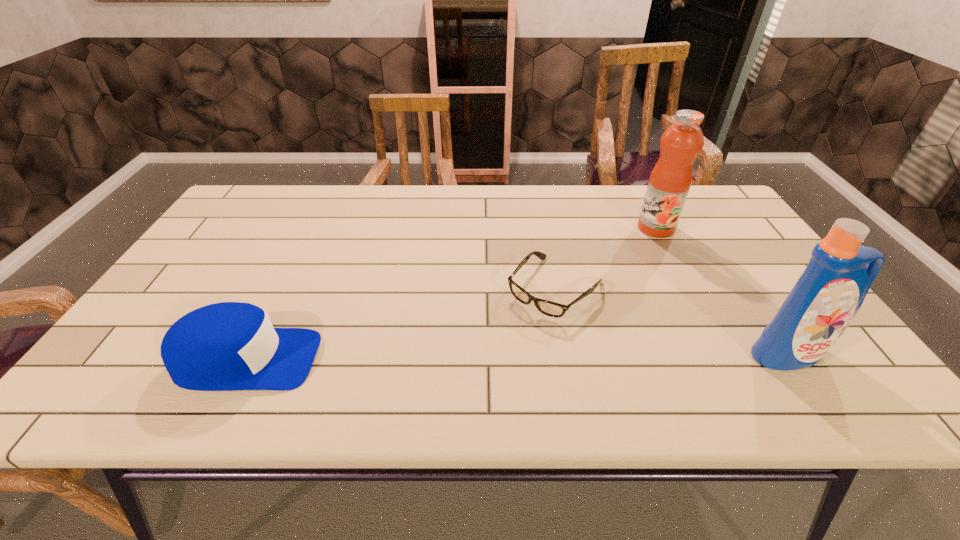
The height and width of the screenshot is (540, 960). In the image, there is a desktop. Identify the location of free region at the far edge. (x=346, y=215).

This screenshot has height=540, width=960. In the image, there is a desktop. Identify the location of vacant region at the near edge. (675, 343).

I want to click on free location at the left edge of the desktop, so click(244, 235).

Find the location of a particular element. The height and width of the screenshot is (540, 960). vacant space at the right edge of the desktop is located at coordinates pyautogui.click(x=751, y=281).

At what (x,y) coordinates should I click in order to perform the action: click on vacant space at the far left corner of the desktop. Please return your answer as a coordinate pair (x, y). This screenshot has height=540, width=960. Looking at the image, I should click on (252, 203).

The image size is (960, 540). I want to click on free space at the far right corner of the desktop, so click(703, 222).

I want to click on free space between the leftmost object and the detergent, so click(x=517, y=356).

Identify the location of free spot between the farthest object and the second farthest object. (606, 258).

Locate an element on the screen. Image resolution: width=960 pixels, height=540 pixels. empty location between the detergent and the spectacles is located at coordinates (672, 321).

Find the location of a particular element. vacant space that is in between the third object from right to left and the detergent is located at coordinates (672, 321).